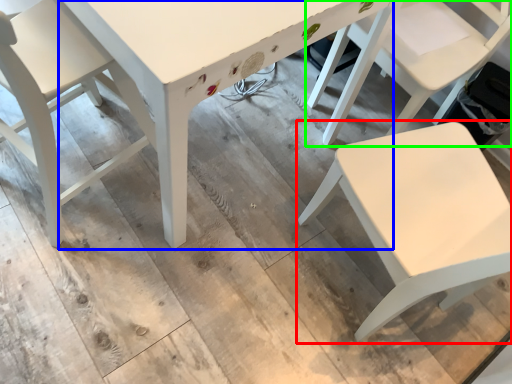
Question: Which object is positioned farthest from chair (highlighted by a red box)? Select from table (highlighted by a blue box) and chair (highlighted by a green box).

Choices:
 (A) table
 (B) chair

Answer: (A)